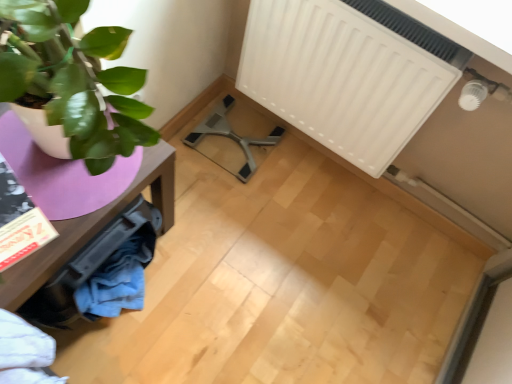
Question: From a real-world perspective, does metallic gray swivel chair at center sit lower than white matte radiator at upper right?

Choices:
 (A) yes
 (B) no

Answer: (A)

Question: Considering the relative positions of metallic gray swivel chair at center and white matte radiator at upper right in the image provided, is metallic gray swivel chair at center to the right of white matte radiator at upper right from the viewer's perspective?

Choices:
 (A) yes
 (B) no

Answer: (B)

Question: Is metallic gray swivel chair at center far from white matte radiator at upper right?

Choices:
 (A) yes
 (B) no

Answer: (B)

Question: Does metallic gray swivel chair at center have a larger size compared to white matte radiator at upper right?

Choices:
 (A) yes
 (B) no

Answer: (B)

Question: Is metallic gray swivel chair at center positioned beyond the bounds of white matte radiator at upper right?

Choices:
 (A) no
 (B) yes

Answer: (B)

Question: Could white matte radiator at upper right be considered to be inside metallic gray swivel chair at center?

Choices:
 (A) yes
 (B) no

Answer: (B)

Question: Does metallic gray swivel chair at center appear on the left side of matte purple table at left?

Choices:
 (A) no
 (B) yes

Answer: (A)

Question: Is metallic gray swivel chair at center located outside matte purple table at left?

Choices:
 (A) no
 (B) yes

Answer: (B)

Question: Can you see metallic gray swivel chair at center touching matte purple table at left?

Choices:
 (A) yes
 (B) no

Answer: (B)

Question: Is matte purple table at left completely or partially inside metallic gray swivel chair at center?

Choices:
 (A) no
 (B) yes

Answer: (A)

Question: Is the position of metallic gray swivel chair at center more distant than that of matte purple table at left?

Choices:
 (A) yes
 (B) no

Answer: (A)

Question: Is matte purple table at left at the back of metallic gray swivel chair at center?

Choices:
 (A) no
 (B) yes

Answer: (A)

Question: Is matte purple table at left turned away from metallic gray swivel chair at center?

Choices:
 (A) no
 (B) yes

Answer: (B)